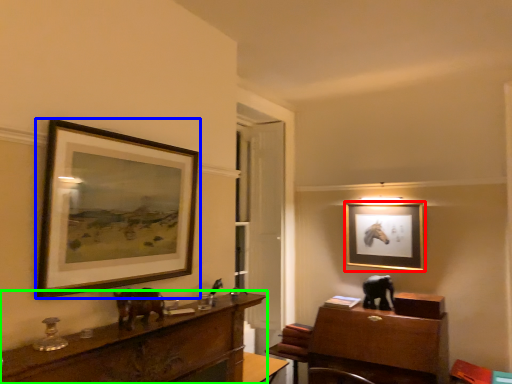
Question: Which is farther away from picture frame (highlighted by a red box)? picture frame (highlighted by a blue box) or desk (highlighted by a green box)?

Choices:
 (A) picture frame
 (B) desk

Answer: (A)